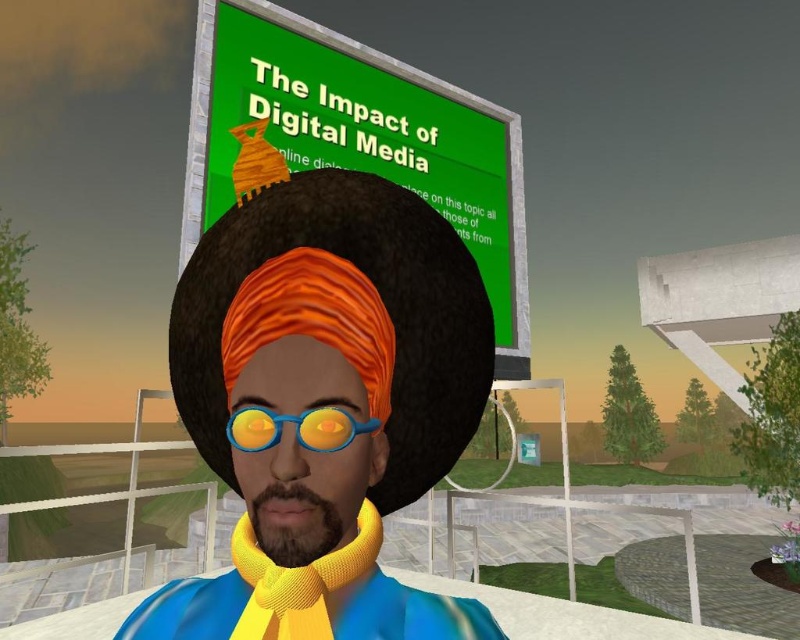
Consider the image. Between yellow matte scarf at center and brown fuzzy beard at center, which one appears on the right side from the viewer's perspective?

Positioned to the right is brown fuzzy beard at center.

Does yellow matte scarf at center have a larger size compared to brown fuzzy beard at center?

Yes, yellow matte scarf at center is bigger than brown fuzzy beard at center.

What do you see at coordinates (328, 397) in the screenshot? This screenshot has height=640, width=800. I see `yellow matte scarf at center` at bounding box center [328, 397].

Find the location of `yellow matte scarf at center`. yellow matte scarf at center is located at coordinates (328, 397).

Between yellow matte scarf at center and blue rubber goggles at center, which one has less height?

Standing shorter between the two is blue rubber goggles at center.

Is yellow matte scarf at center above blue rubber goggles at center?

No, yellow matte scarf at center is not above blue rubber goggles at center.

This screenshot has height=640, width=800. In order to click on yellow matte scarf at center in this screenshot , I will do (328, 397).

Is yellow knitted scarf at center to the right of blue rubber goggles at center from the viewer's perspective?

Incorrect, yellow knitted scarf at center is not on the right side of blue rubber goggles at center.

Is yellow knitted scarf at center shorter than blue rubber goggles at center?

No, yellow knitted scarf at center is not shorter than blue rubber goggles at center.

Is point (354, 568) positioned before point (328, 435)?

That is False.

You are a GUI agent. You are given a task and a screenshot of the screen. Output one action in this format:
    pyautogui.click(x=<x>, y=<y>)
    Task: Click on the yellow knitted scarf at center
    
    Given the screenshot: What is the action you would take?
    pyautogui.click(x=298, y=580)